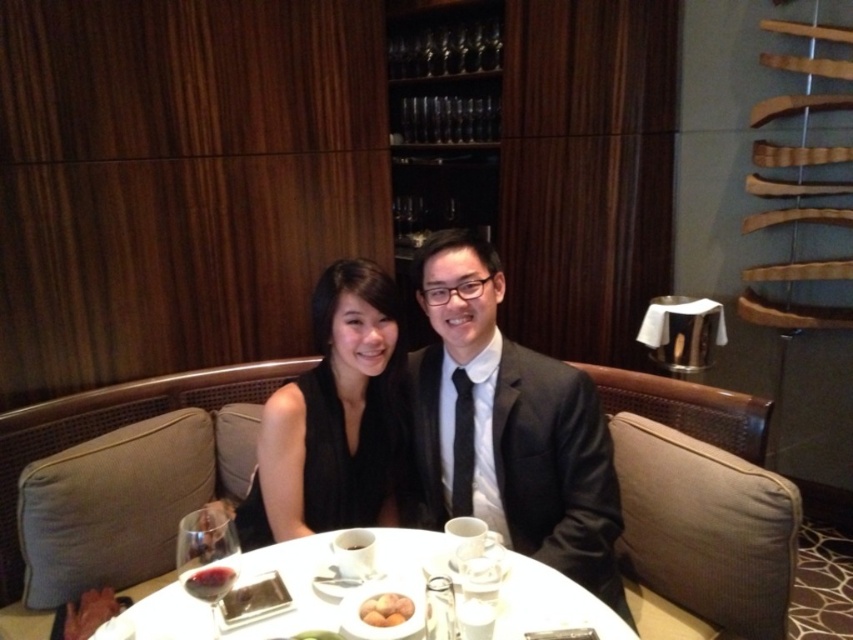
You are a photographer positioned behind the black satin dress at center and the smooth yellow eggs at table center. Which object is closer to you?

The black satin dress at center is closer to you because it is further to the viewer than the smooth yellow eggs at table center.

You are a server at a restaurant and need to place a new dish on the table. The dish is 15 cm in diameter. Can you fit it on the white glossy table at center without overlapping the smooth yellow eggs at table center?

The white glossy table at center might be wider than smooth yellow eggs at table center. Since the table is wider, there should be enough space to place the 15 cm dish without overlapping the eggs.

You are a waiter in a restaurant. You need to place a dessert menu on the table between the matte black suit at center and the smooth yellow eggs at table center. Where should you place the dessert menu so it is visible to both guests?

The dessert menu should be placed between the matte black suit at center and the smooth yellow eggs at table center. Since the matte black suit at center is located above the smooth yellow eggs at table center, placing the dessert menu in the middle of this vertical space would ensure visibility for both guests.